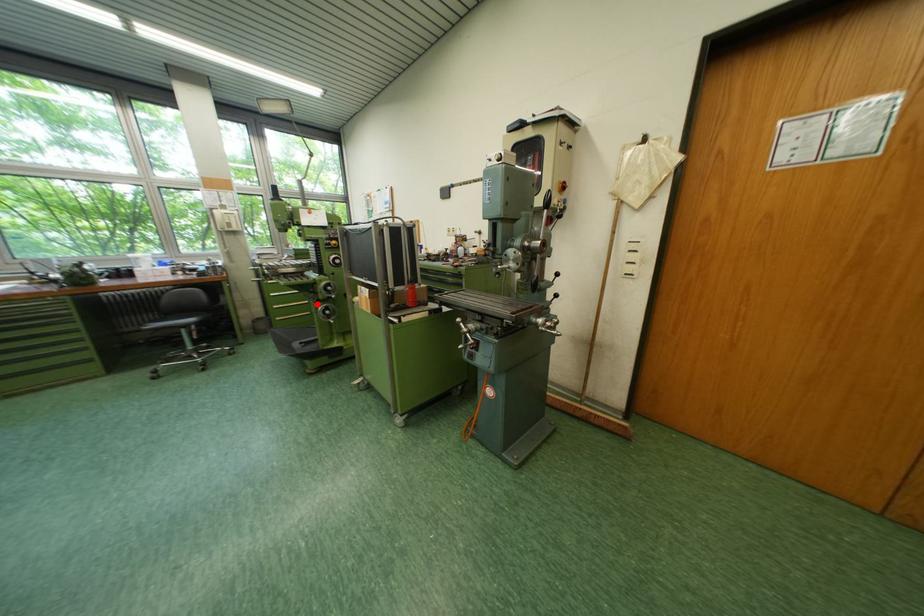
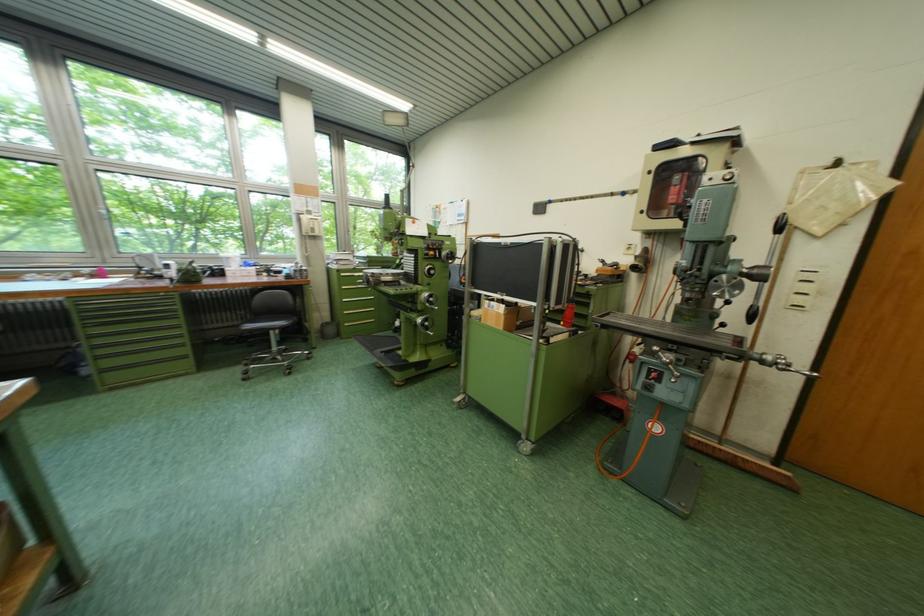
Question: I am providing you with two images of the same scene from different viewpoints. A red point is shown in image1. For the corresponding object point in image2, is it positioned nearer or farther from the camera?

Choices:
 (A) Nearer
 (B) Farther

Answer: (A)